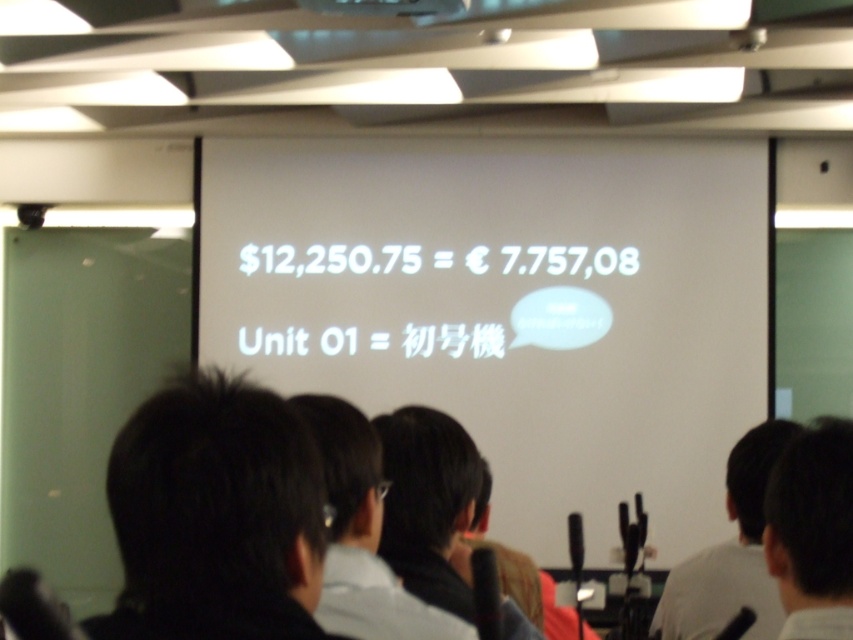
You are an attendee in the conference room and want to see both the black hair at left and the dark hair at upper right. Which one can you see more clearly?

The black hair at left is closer to the viewer than the dark hair at upper right, so you can see the black hair at left more clearly.

Based on the scene description, what object is located at the coordinate point (215,516)?

Result: The object located at the coordinate point (215,516) is black hair at left.